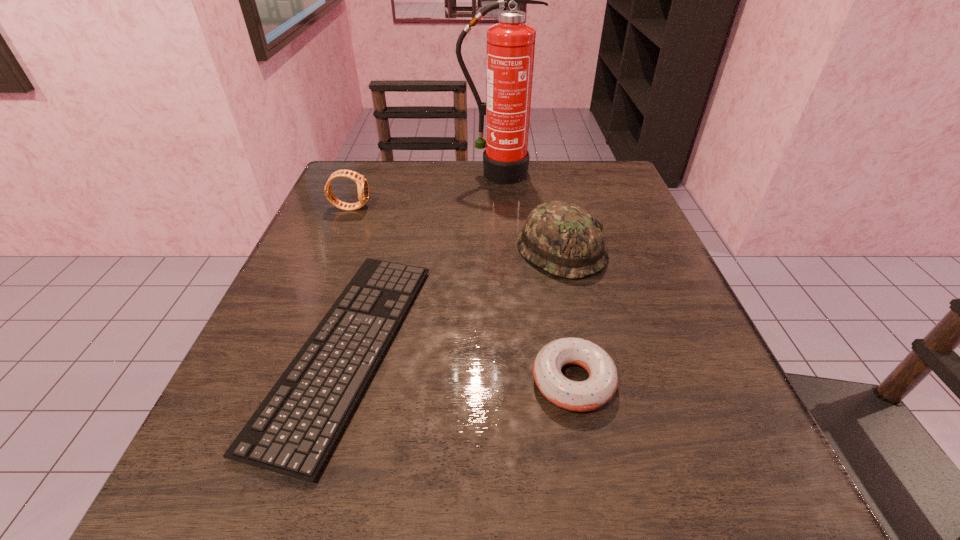
Where is `vacant space situated 0.140m on the back of the shortest object`? This screenshot has width=960, height=540. vacant space situated 0.140m on the back of the shortest object is located at coordinates (385, 221).

At what (x,y) coordinates should I click in order to perform the action: click on fire extinguisher present at the far edge. Please return your answer as a coordinate pair (x, y). The image size is (960, 540). Looking at the image, I should click on (510, 43).

At what (x,y) coordinates should I click in order to perform the action: click on watch located at the far edge. Please return your answer as a coordinate pair (x, y). The height and width of the screenshot is (540, 960). Looking at the image, I should click on (362, 185).

This screenshot has height=540, width=960. What are the coordinates of `object located in the near edge section of the desktop` in the screenshot? It's located at (292, 432).

In order to click on watch that is at the left edge in this screenshot , I will do `click(362, 185)`.

Locate an element on the screen. The width and height of the screenshot is (960, 540). computer keyboard that is at the left edge is located at coordinates (292, 432).

Where is `headwear situated at the right edge`? headwear situated at the right edge is located at coordinates (563, 239).

You are a GUI agent. You are given a task and a screenshot of the screen. Output one action in this format:
    pyautogui.click(x=<x>, y=<y>)
    Task: Click on the doughnut at the right edge
    The height and width of the screenshot is (540, 960).
    Given the screenshot: What is the action you would take?
    pyautogui.click(x=598, y=389)

The width and height of the screenshot is (960, 540). Find the location of `object present at the far left corner`. object present at the far left corner is located at coordinates (362, 185).

The image size is (960, 540). Find the location of `object at the near left corner`. object at the near left corner is located at coordinates (292, 432).